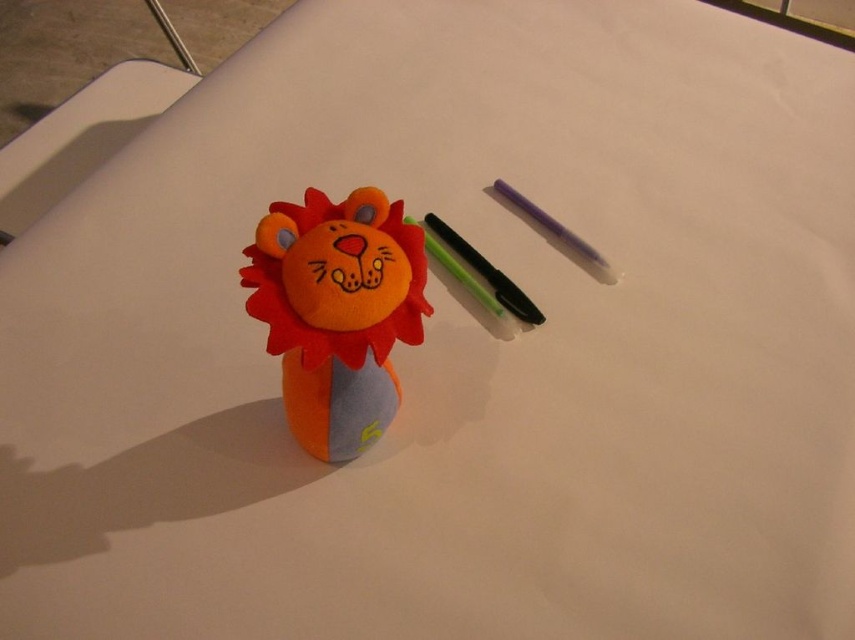
You are an artist who wants to draw on the soft plush lion at center using the black glossy pen at center. Can you easily access the lion to draw on it without moving the pen?

The soft plush lion at center is positioned under the black glossy pen at center, so you can easily access the lion to draw on it without moving the pen.

You are standing in a room and see the soft plush lion at center. If you were to walk directly towards it, which direction should you move relative to your current position?

The soft plush lion at center is located at point (337, 312), so you should move forward slightly to the right to reach it.